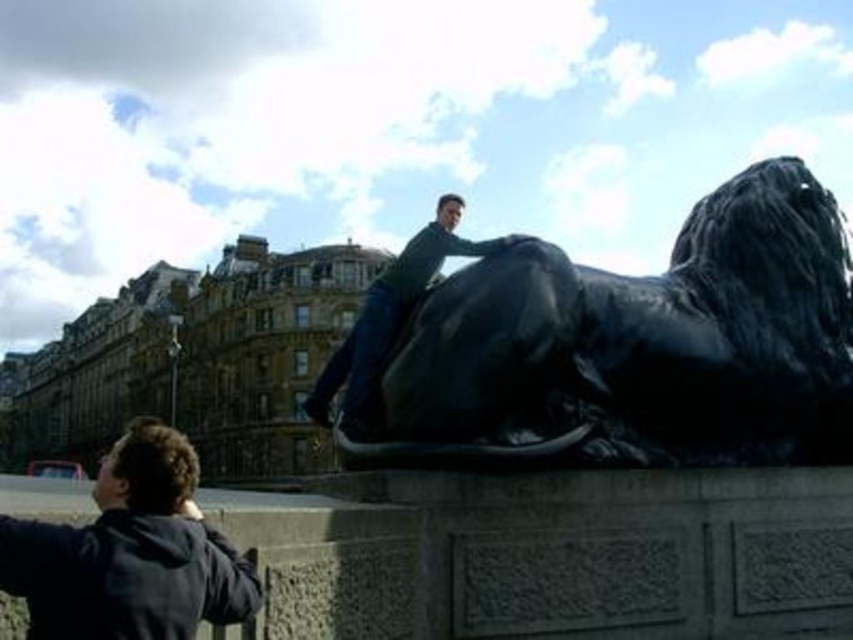
Between black polished stone lion at upper center and matte black statue at center, which one has more height?

matte black statue at center

Between black polished stone lion at upper center and matte black statue at center, which one has less height?

black polished stone lion at upper center

What do you see at coordinates (637, 348) in the screenshot? The image size is (853, 640). I see `black polished stone lion at upper center` at bounding box center [637, 348].

The image size is (853, 640). Find the location of `black polished stone lion at upper center`. black polished stone lion at upper center is located at coordinates (637, 348).

Which is above, black polished stone lion at upper center or dark blue jacket at lower left?

black polished stone lion at upper center

This screenshot has width=853, height=640. What do you see at coordinates (637, 348) in the screenshot?
I see `black polished stone lion at upper center` at bounding box center [637, 348].

Who is more forward, [703,237] or [166,524]?

Positioned in front is point [166,524].

I want to click on black polished stone lion at upper center, so click(637, 348).

Can you confirm if dark blue jacket at lower left is positioned above matte black statue at center?

Actually, dark blue jacket at lower left is below matte black statue at center.

Between dark blue jacket at lower left and matte black statue at center, which one is positioned lower?

dark blue jacket at lower left is lower down.

Which is behind, point (175, 468) or point (448, 205)?

The point (448, 205) is behind.

Image resolution: width=853 pixels, height=640 pixels. In order to click on dark blue jacket at lower left in this screenshot , I will do `click(131, 554)`.